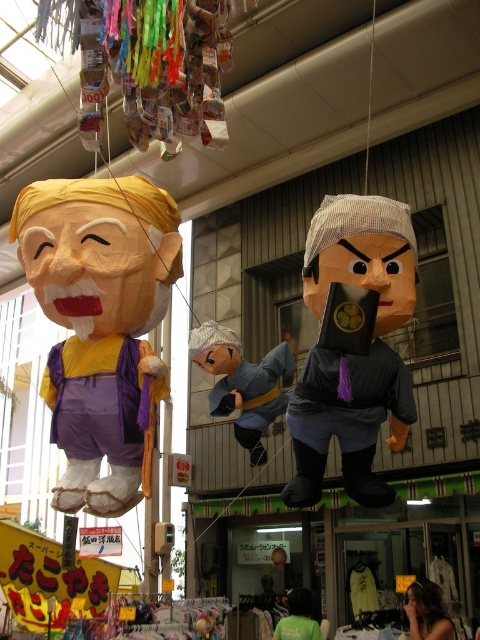
Question: Estimate the real-world distances between objects in this image. Which object is farther from the green fabric shirt at lower center?

Choices:
 (A) matte gray fabric at center
 (B) smooth brown hair at center
 (C) matte yellow paper doll at left
 (D) matte gray fabric toy at center

Answer: (C)

Question: Where is matte gray fabric at center located in relation to smooth brown hair at center in the image?

Choices:
 (A) left
 (B) right

Answer: (A)

Question: Is matte gray fabric at center closer to the viewer compared to matte gray fabric toy at center?

Choices:
 (A) no
 (B) yes

Answer: (B)

Question: In this image, where is matte gray fabric at center located relative to smooth brown hair at center?

Choices:
 (A) above
 (B) below

Answer: (A)

Question: Estimate the real-world distances between objects in this image. Which object is closer to the smooth brown hair at center?

Choices:
 (A) green fabric shirt at lower center
 (B) matte gray fabric at center
 (C) matte gray fabric toy at center

Answer: (A)

Question: Which is nearer to the smooth brown hair at center?

Choices:
 (A) matte gray fabric at center
 (B) matte yellow paper doll at left
 (C) green fabric shirt at lower center
 (D) matte gray fabric toy at center

Answer: (C)